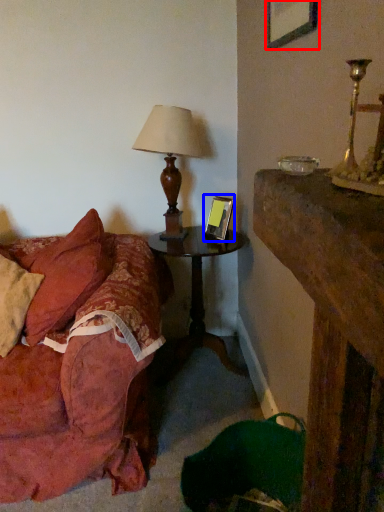
Question: Which of the following is the closest to the observer, picture frame (highlighted by a red box) or picture frame (highlighted by a blue box)?

Choices:
 (A) picture frame
 (B) picture frame

Answer: (A)